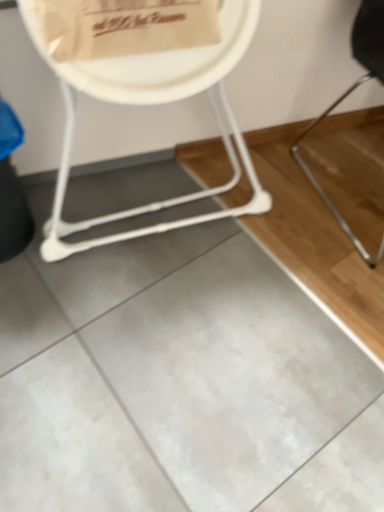
The image size is (384, 512). Identify the location of vacant space in front of white plastic chair at upper left, which is counted as the 1th chair, starting from the left. (155, 337).